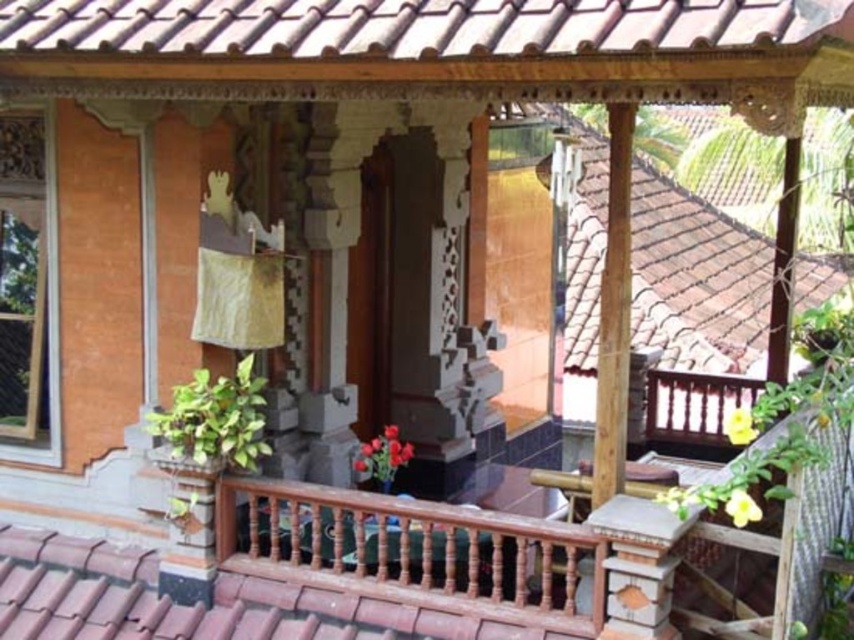
Question: Considering the real-world distances, which object is farthest from the brown clay tiles at upper center?

Choices:
 (A) brown wooden balustrade at center
 (B) brown tile roof at upper right

Answer: (B)

Question: In this image, where is brown clay tiles at upper center located relative to brown wooden balustrade at center?

Choices:
 (A) left
 (B) right

Answer: (A)

Question: Based on their relative distances, which object is farther from the brown tile roof at upper right?

Choices:
 (A) brown wooden balustrade at center
 (B) brown clay tiles at upper center

Answer: (B)

Question: Does brown clay tiles at upper center appear over brown wooden balustrade at center?

Choices:
 (A) yes
 (B) no

Answer: (A)

Question: Considering the relative positions of brown wooden balustrade at center and brown tile roof at upper right in the image provided, where is brown wooden balustrade at center located with respect to brown tile roof at upper right?

Choices:
 (A) left
 (B) right

Answer: (A)

Question: Which point is farther from the camera taking this photo?

Choices:
 (A) click(x=442, y=538)
 (B) click(x=202, y=8)

Answer: (A)